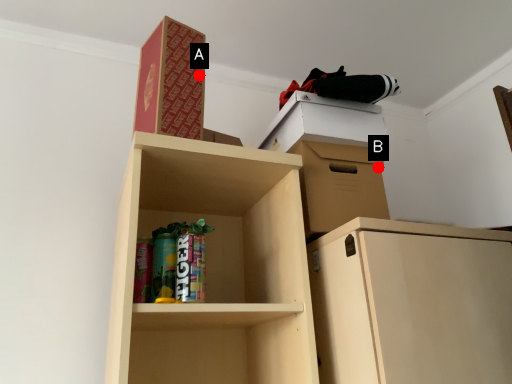
Question: Two points are circled on the image, labeled by A and B beside each circle. Which point appears closest to the camera in this image?

Choices:
 (A) A is closer
 (B) B is closer

Answer: (A)